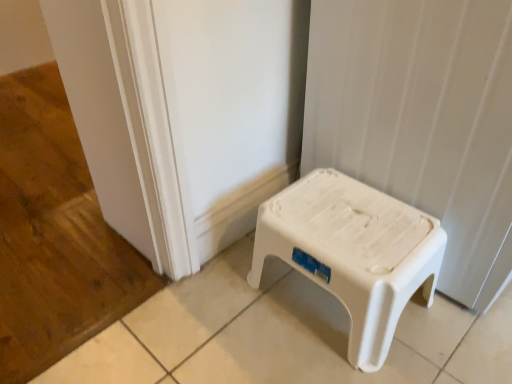
Question: Is white plastic stool at lower right wider or thinner than white plastic stool at center?

Choices:
 (A) thin
 (B) wide

Answer: (B)

Question: From the image's perspective, is white plastic stool at lower right located above or below white plastic stool at center?

Choices:
 (A) above
 (B) below

Answer: (A)

Question: From a real-world perspective, relative to white plastic stool at center, is white plastic stool at lower right vertically above or below?

Choices:
 (A) below
 (B) above

Answer: (B)

Question: In terms of height, does white plastic stool at center look taller or shorter compared to white plastic stool at lower right?

Choices:
 (A) tall
 (B) short

Answer: (B)

Question: Based on their positions, is white plastic stool at center located to the left or right of white plastic stool at lower right?

Choices:
 (A) left
 (B) right

Answer: (A)

Question: From a real-world perspective, is white plastic stool at center above or below white plastic stool at lower right?

Choices:
 (A) below
 (B) above

Answer: (A)

Question: In terms of size, does white plastic stool at center appear bigger or smaller than white plastic stool at lower right?

Choices:
 (A) small
 (B) big

Answer: (A)